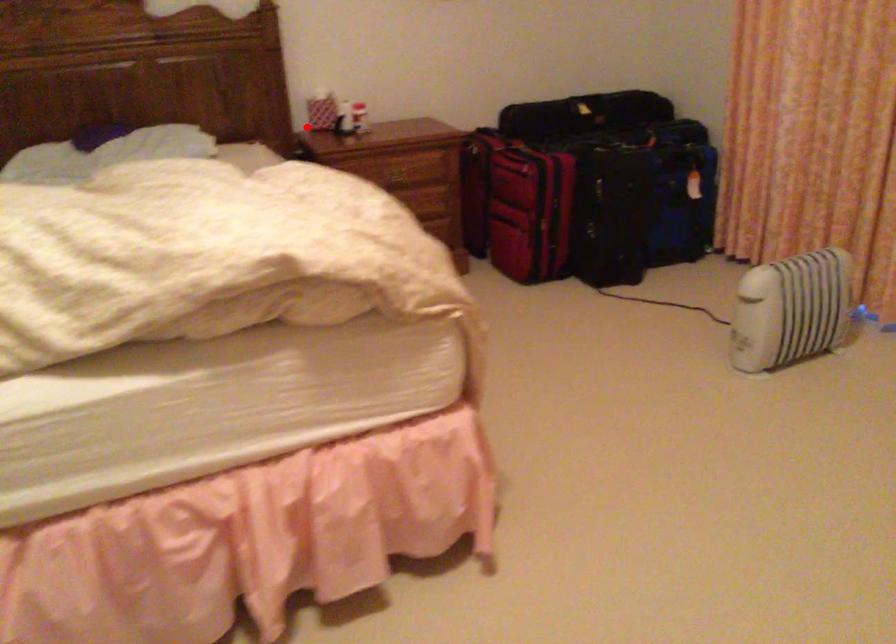
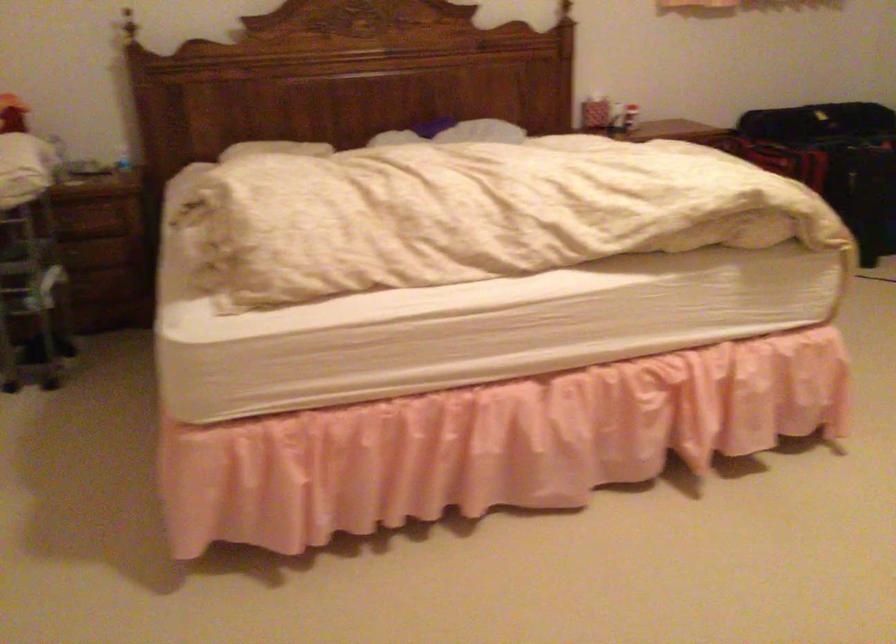
Question: A red point is marked in image1. In image2, is the corresponding 3D point closer to the camera or farther? Reply with the corresponding letter.

Choices:
 (A) The corresponding 3D point is closer.
 (B) The corresponding 3D point is farther.

Answer: (B)